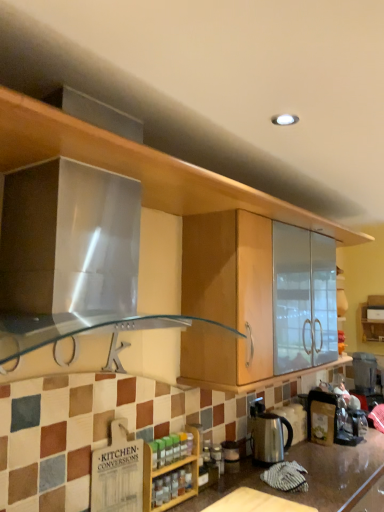
Question: Is wooden spice rack at lower center directly adjacent to polished stainless steel kettle at center?

Choices:
 (A) yes
 (B) no

Answer: (B)

Question: From a real-world perspective, is wooden spice rack at lower center under polished stainless steel kettle at center?

Choices:
 (A) no
 (B) yes

Answer: (A)

Question: Is wooden spice rack at lower center positioned before polished stainless steel kettle at center?

Choices:
 (A) no
 (B) yes

Answer: (B)

Question: Does wooden spice rack at lower center have a larger size compared to polished stainless steel kettle at center?

Choices:
 (A) yes
 (B) no

Answer: (B)

Question: Is wooden spice rack at lower center wider than polished stainless steel kettle at center?

Choices:
 (A) no
 (B) yes

Answer: (A)

Question: Does wooden spice rack at lower center have a smaller size compared to polished stainless steel kettle at center?

Choices:
 (A) no
 (B) yes

Answer: (B)

Question: Is wooden cutting board at lower center turned away from polished stainless steel kettle at center?

Choices:
 (A) yes
 (B) no

Answer: (B)

Question: From a real-world perspective, is wooden cutting board at lower center beneath polished stainless steel kettle at center?

Choices:
 (A) yes
 (B) no

Answer: (A)

Question: Is wooden cutting board at lower center wider than polished stainless steel kettle at center?

Choices:
 (A) no
 (B) yes

Answer: (B)

Question: From a real-world perspective, is wooden cutting board at lower center on top of polished stainless steel kettle at center?

Choices:
 (A) no
 (B) yes

Answer: (A)

Question: Can you confirm if wooden cutting board at lower center is shorter than polished stainless steel kettle at center?

Choices:
 (A) yes
 (B) no

Answer: (A)

Question: From the image's perspective, would you say wooden cutting board at lower center is shown under polished stainless steel kettle at center?

Choices:
 (A) yes
 (B) no

Answer: (A)

Question: From a real-world perspective, is polished stainless steel kettle at center located higher than wooden cutting board at lower center?

Choices:
 (A) yes
 (B) no

Answer: (A)